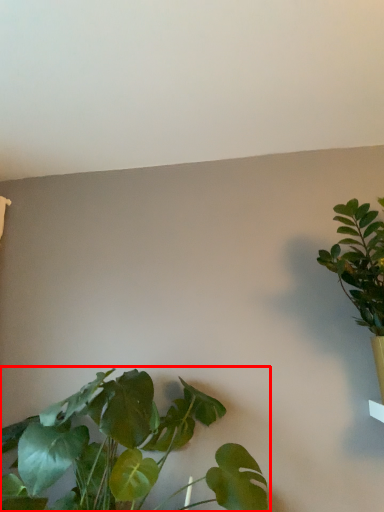
Question: From the image's perspective, where is houseplant (annotated by the red box) located in relation to houseplant in the image?

Choices:
 (A) above
 (B) below

Answer: (B)